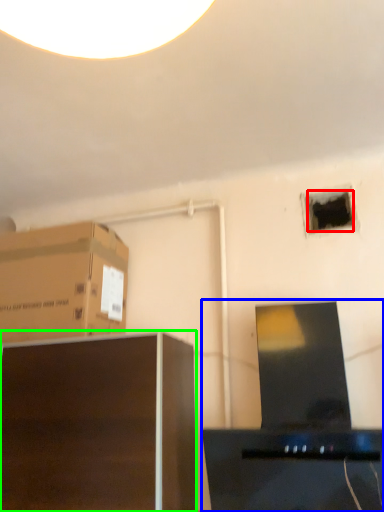
Question: Estimate the real-world distances between objects in this image. Which object is closer to hole (highlighted by a red box), desktop computer (highlighted by a blue box) or furniture (highlighted by a green box)?

Choices:
 (A) desktop computer
 (B) furniture

Answer: (A)